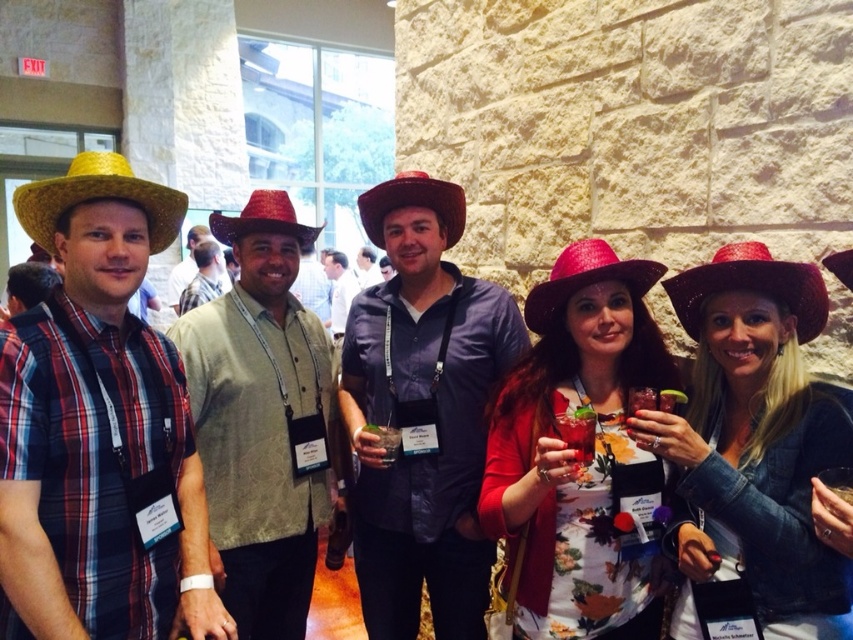
Who is more distant from viewer, (589, 253) or (460, 186)?

Positioned behind is point (460, 186).

Locate an element on the screen. The width and height of the screenshot is (853, 640). pink straw cowboy hat at center is located at coordinates (584, 280).

Which is in front, point (527, 321) or point (450, 212)?

Point (527, 321)

Find the location of a particular element. pink straw cowboy hat at center is located at coordinates (584, 280).

Between point (30, 184) and point (573, 262), which one is positioned in front?

Point (30, 184)

Can you confirm if yellow straw cowboy hat at left is shorter than pink straw cowboy hat at center?

No, yellow straw cowboy hat at left is not shorter than pink straw cowboy hat at center.

Does point (70, 172) come closer to viewer compared to point (532, 304)?

Yes, point (70, 172) is closer to viewer.

In order to click on yellow straw cowboy hat at left in this screenshot , I will do `click(97, 198)`.

Between sparkly red cowboy hat at right and matte brown cowboy hat at center, which one has less height?

With less height is sparkly red cowboy hat at right.

The height and width of the screenshot is (640, 853). Describe the element at coordinates (751, 285) in the screenshot. I see `sparkly red cowboy hat at right` at that location.

Is point (805, 300) closer to camera compared to point (444, 230)?

Yes, point (805, 300) is closer to viewer.

You are a GUI agent. You are given a task and a screenshot of the screen. Output one action in this format:
    pyautogui.click(x=<x>, y=<y>)
    Task: Click on the sparkly red cowboy hat at right
    This screenshot has height=640, width=853.
    Given the screenshot: What is the action you would take?
    pyautogui.click(x=751, y=285)